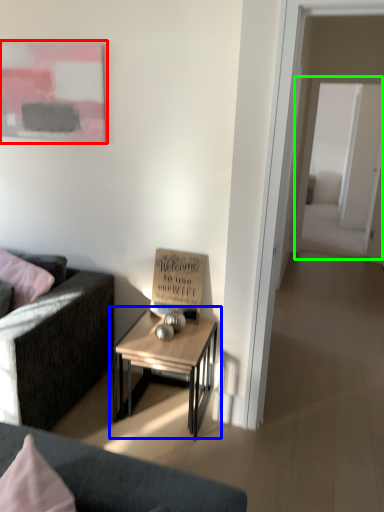
Question: Considering the real-world distances, which object is closest to picture frame (highlighted by a red box)? table (highlighted by a blue box) or glass door (highlighted by a green box).

Choices:
 (A) table
 (B) glass door

Answer: (A)